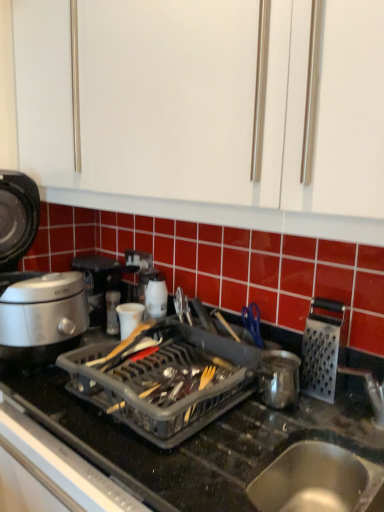
Question: In the image, is silver metallic grater at right, which ranks as the 1th kitchen appliance in right-to-left order, positioned in front of or behind shiny metallic pot at center, the second kitchen appliance in the right-to-left sequence?

Choices:
 (A) front
 (B) behind

Answer: (B)

Question: Looking at their shapes, would you say silver metallic grater at right, which ranks as the 1th kitchen appliance in right-to-left order, is wider or thinner than shiny metallic pot at center, placed as the 4th kitchen appliance when sorted from left to right?

Choices:
 (A) thin
 (B) wide

Answer: (A)

Question: Considering the real-world distances, which object is farthest from the shiny metallic pot at center, placed as the 4th kitchen appliance when sorted from left to right?

Choices:
 (A) white matte cup at center, which is the 4th kitchen appliance from right to left
 (B) black plastic dish rack at center
 (C) silver metallic rice cooker at left, the 5th kitchen appliance when ordered from right to left
 (D) silver metallic grater at right, positioned as the fifth kitchen appliance in left-to-right order
 (E) white plastic kettle at center, the 3th kitchen appliance positioned from the right

Answer: (C)

Question: Considering the real-world distances, which object is closest to the transparent plastic dish rack at center?

Choices:
 (A) shiny metallic pot at center, the second kitchen appliance in the right-to-left sequence
 (B) white matte cup at center, which is the 4th kitchen appliance from right to left
 (C) metallic stainless steel sink at lower right
 (D) black plastic dish rack at center
 (E) silver metallic rice cooker at left, which is counted as the 1th kitchen appliance, starting from the left

Answer: (D)